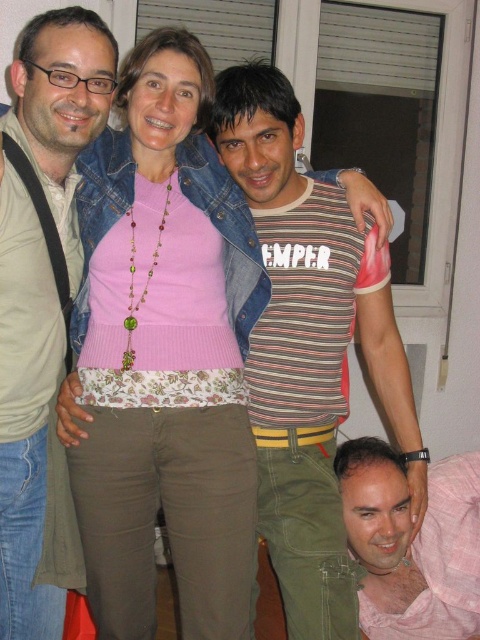
Is matte black shirt at left smaller than pink fabric shirt at lower right?

Incorrect, matte black shirt at left is not smaller in size than pink fabric shirt at lower right.

Does matte black shirt at left come behind pink fabric shirt at lower right?

No, matte black shirt at left is in front of pink fabric shirt at lower right.

Is point (64, 282) positioned in front of point (389, 595)?

Yes, it is.

Identify the location of matte black shirt at left. The image size is (480, 640). (43, 304).

How far apart are striped cotton shirt at center and matte black shirt at left?

A distance of 20.31 inches exists between striped cotton shirt at center and matte black shirt at left.

Which is in front, point (414, 483) or point (60, 141)?

Point (60, 141) is more forward.

You are a GUI agent. You are given a task and a screenshot of the screen. Output one action in this format:
    pyautogui.click(x=<x>, y=<y>)
    Task: Click on the striped cotton shirt at center
    This screenshot has width=480, height=640.
    Given the screenshot: What is the action you would take?
    pyautogui.click(x=309, y=348)

How far apart are striped cotton shirt at center and pink fabric shirt at lower right?

striped cotton shirt at center is 12.10 inches away from pink fabric shirt at lower right.

Measure the distance between striped cotton shirt at center and camera.

4.56 feet

Is point (313, 356) more distant than point (376, 554)?

No, (313, 356) is in front of (376, 554).

Identify the location of striped cotton shirt at center. (309, 348).